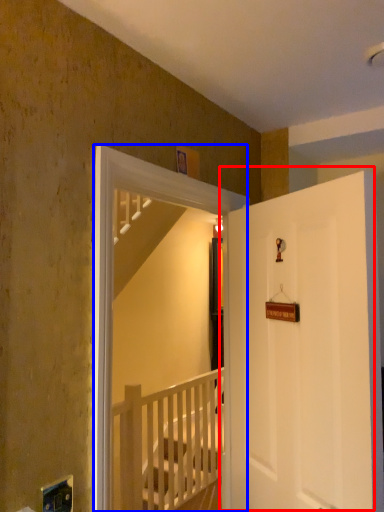
Question: Which point is further to the camera, door (highlighted by a red box) or screen door (highlighted by a blue box)?

Choices:
 (A) door
 (B) screen door

Answer: (B)